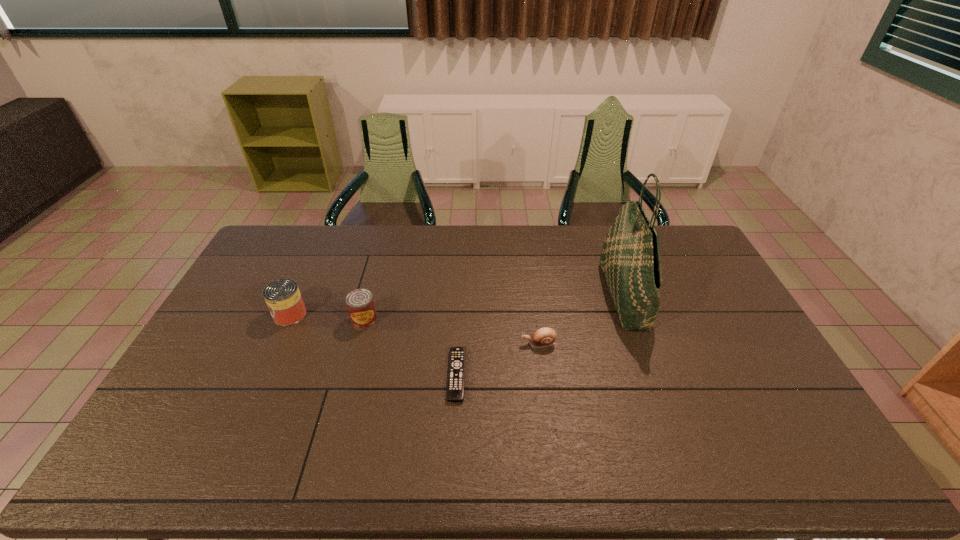
The width and height of the screenshot is (960, 540). I want to click on tote bag, so click(x=630, y=259).

Locate an element on the screen. the rightmost object is located at coordinates [630, 259].

Identify the location of the left can. The height and width of the screenshot is (540, 960). (282, 296).

Find the location of `the right can`. the right can is located at coordinates (360, 303).

Where is `the second shortest object`? This screenshot has height=540, width=960. the second shortest object is located at coordinates (543, 337).

This screenshot has width=960, height=540. Identify the location of escargot. (543, 337).

Where is `remote control`? Image resolution: width=960 pixels, height=540 pixels. remote control is located at coordinates (456, 372).

You are a GUI agent. You are given a task and a screenshot of the screen. Output one action in this format:
    pyautogui.click(x=<x>, y=<y>)
    Task: Click on the third object from right to left
    
    Given the screenshot: What is the action you would take?
    pyautogui.click(x=456, y=372)

This screenshot has height=540, width=960. I want to click on vacant space located on the back of the tote bag, so click(608, 250).

Find the location of a particular element. vacant space located on the front of the left can is located at coordinates (266, 367).